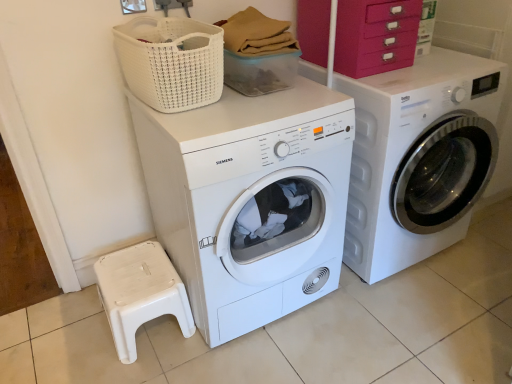
Question: In the image, is white plastic step stool at lower left positioned in front of or behind white matte washing machine at center, which is counted as the second washing machine, starting from the right?

Choices:
 (A) behind
 (B) front

Answer: (A)

Question: In terms of size, does white plastic step stool at lower left appear bigger or smaller than white matte washing machine at center, which is the 1th washing machine from left to right?

Choices:
 (A) big
 (B) small

Answer: (B)

Question: Which is nearer to the pink plastic drawers at upper right?

Choices:
 (A) white woven basket at upper center
 (B) white glossy washing machine at right, which appears as the 1th washing machine when viewed from the right
 (C) white matte washing machine at center, which is counted as the second washing machine, starting from the right
 (D) white plastic step stool at lower left

Answer: (B)

Question: Considering the real-world distances, which object is closest to the pink plastic drawers at upper right?

Choices:
 (A) white matte washing machine at center, which is the 1th washing machine from left to right
 (B) white plastic step stool at lower left
 (C) white glossy washing machine at right, which appears as the 1th washing machine when viewed from the right
 (D) white woven basket at upper center

Answer: (C)